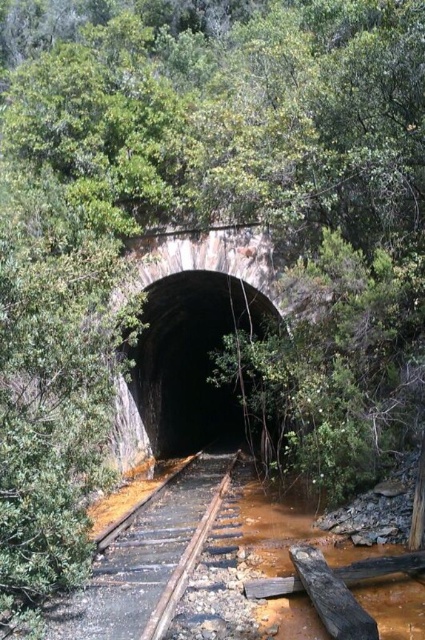
Who is more forward, (153, 292) or (118, 531)?

Point (118, 531) is more forward.

Does black concrete tunnel at center have a greater width compared to brown wooden train track at center?

Indeed, black concrete tunnel at center has a greater width compared to brown wooden train track at center.

Between point (159, 387) and point (189, 547), which one is positioned behind?

Positioned behind is point (159, 387).

Identify the location of black concrete tunnel at center. (187, 364).